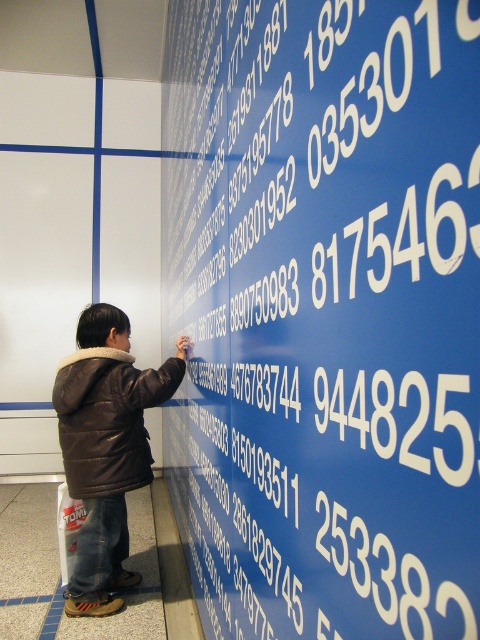
Question: Which object is the farthest from the blue matte wall at center?

Choices:
 (A) brown leather jacket at center
 (B) black leather jacket at left

Answer: (A)

Question: Can you confirm if blue matte wall at center is smaller than black leather jacket at left?

Choices:
 (A) no
 (B) yes

Answer: (A)

Question: Which point is closer to the camera taking this photo?

Choices:
 (A) (82, 436)
 (B) (223, 172)
 (C) (155, 388)

Answer: (B)

Question: Is brown leather jacket at center thinner than black leather jacket at left?

Choices:
 (A) no
 (B) yes

Answer: (A)

Question: Among these objects, which one is nearest to the camera?

Choices:
 (A) black leather jacket at left
 (B) blue matte wall at center

Answer: (B)

Question: Is blue matte wall at center to the right of black leather jacket at left from the viewer's perspective?

Choices:
 (A) no
 (B) yes

Answer: (B)